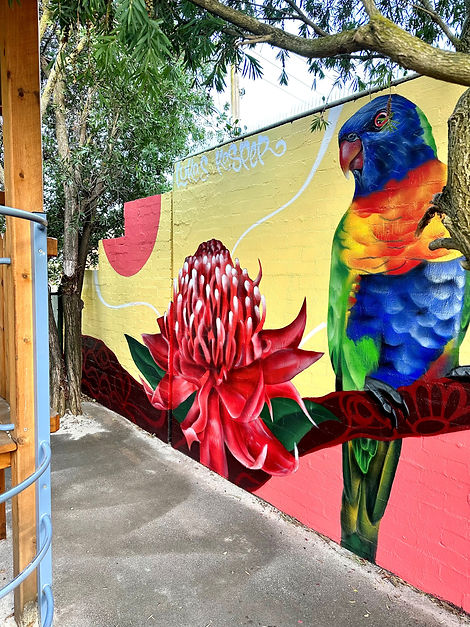
Where is `mural painting of yellow paint`? The image size is (470, 627). mural painting of yellow paint is located at coordinates (305, 255).